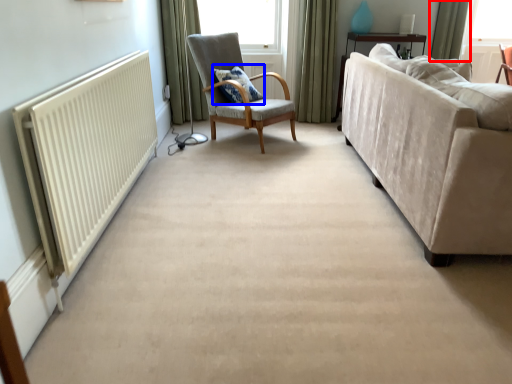
Question: Which point is closer to the camera, curtain (highlighted by a red box) or pillow (highlighted by a blue box)?

Choices:
 (A) curtain
 (B) pillow

Answer: (B)